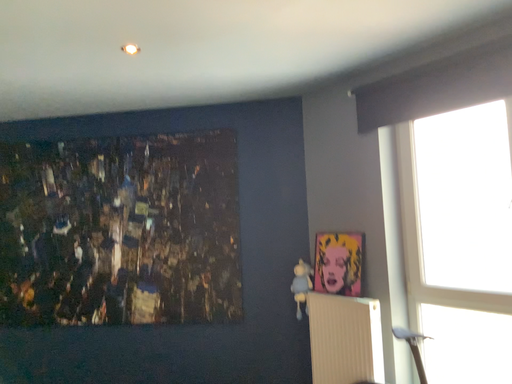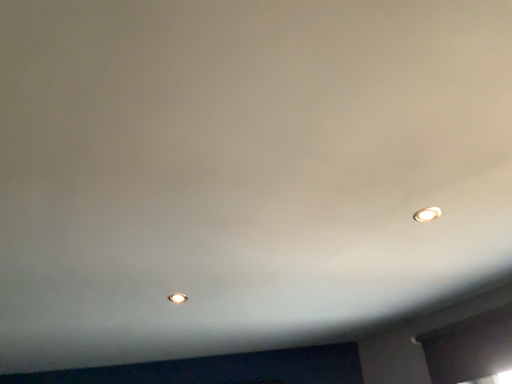
Question: Which way did the camera rotate in the video?

Choices:
 (A) rotated upward
 (B) rotated downward

Answer: (A)